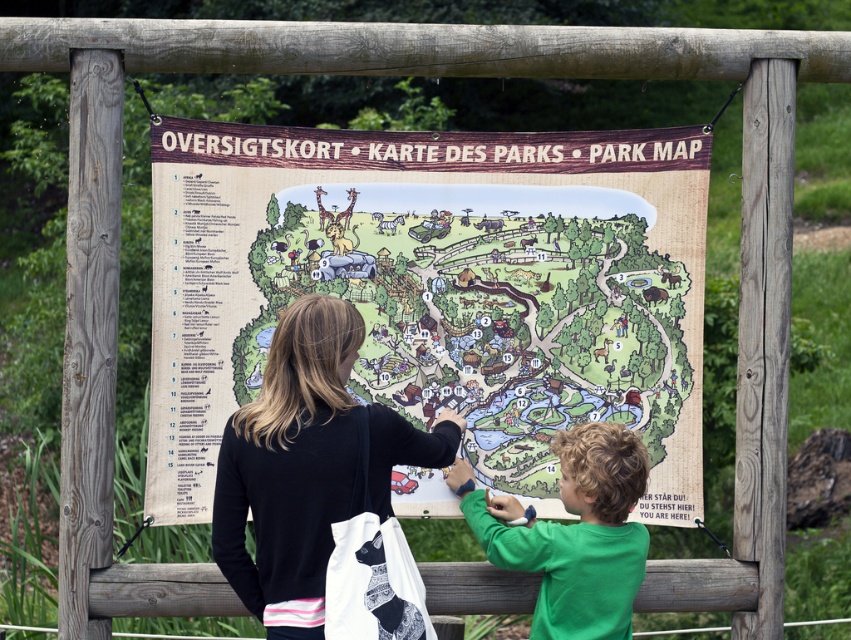
Question: Which of the following is the farthest from the observer?

Choices:
 (A) cartoon paper map at center
 (B) green matte shirt at lower right

Answer: (A)

Question: Estimate the real-world distances between objects in this image. Which object is farther from the green matte shirt at lower right?

Choices:
 (A) cartoon paper map at center
 (B) black fabric bag at center

Answer: (B)

Question: Which of the following is the farthest from the observer?

Choices:
 (A) (340, 394)
 (B) (580, 314)
 (C) (555, 614)

Answer: (B)

Question: From the image, what is the correct spatial relationship of cartoon paper map at center in relation to green matte shirt at lower right?

Choices:
 (A) below
 (B) above

Answer: (B)

Question: Is cartoon paper map at center smaller than green matte shirt at lower right?

Choices:
 (A) no
 (B) yes

Answer: (A)

Question: Can you confirm if cartoon paper map at center is wider than green matte shirt at lower right?

Choices:
 (A) yes
 (B) no

Answer: (A)